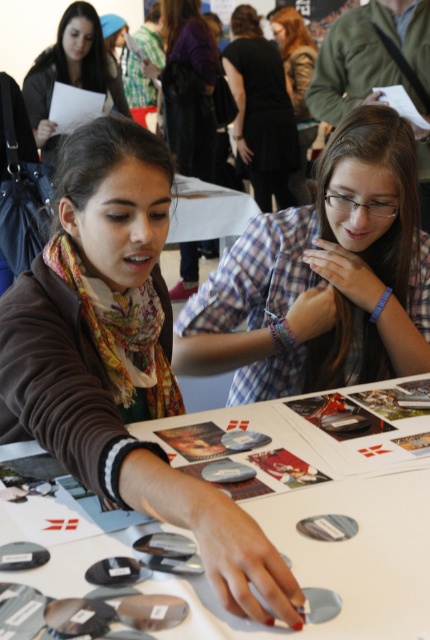
Question: Which object appears farthest from the camera in this image?

Choices:
 (A) brown matte scarf at center
 (B) plaid shirt at center
 (C) matte black jacket at upper left

Answer: (C)

Question: Can you confirm if metallic silver discs at center is positioned to the right of matte scarf at center?

Choices:
 (A) yes
 (B) no

Answer: (A)

Question: Is plaid shirt at center in front of matte black jacket at upper left?

Choices:
 (A) yes
 (B) no

Answer: (A)

Question: Which object appears farthest from the camera in this image?

Choices:
 (A) metallic silver discs at center
 (B) brown matte scarf at center
 (C) matte black jacket at upper left

Answer: (C)

Question: Among these points, which one is farthest from the camera?

Choices:
 (A) (303, 164)
 (B) (359, 460)
 (C) (83, 204)

Answer: (A)

Question: Is the position of brown matte scarf at center less distant than that of black dress at center?

Choices:
 (A) no
 (B) yes

Answer: (B)